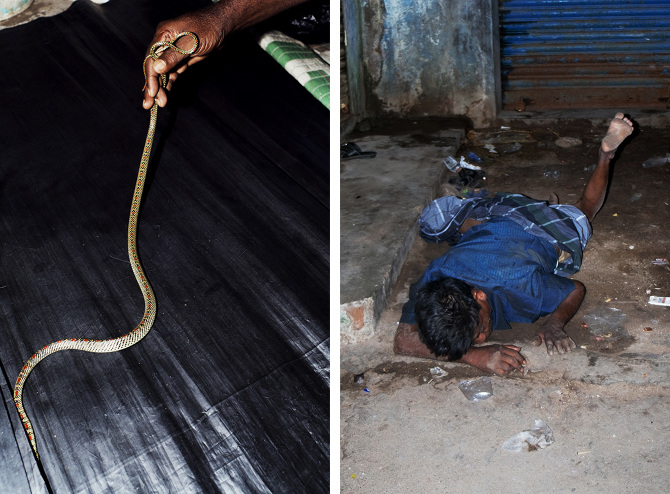
Where is `cement wall`? cement wall is located at coordinates (439, 43).